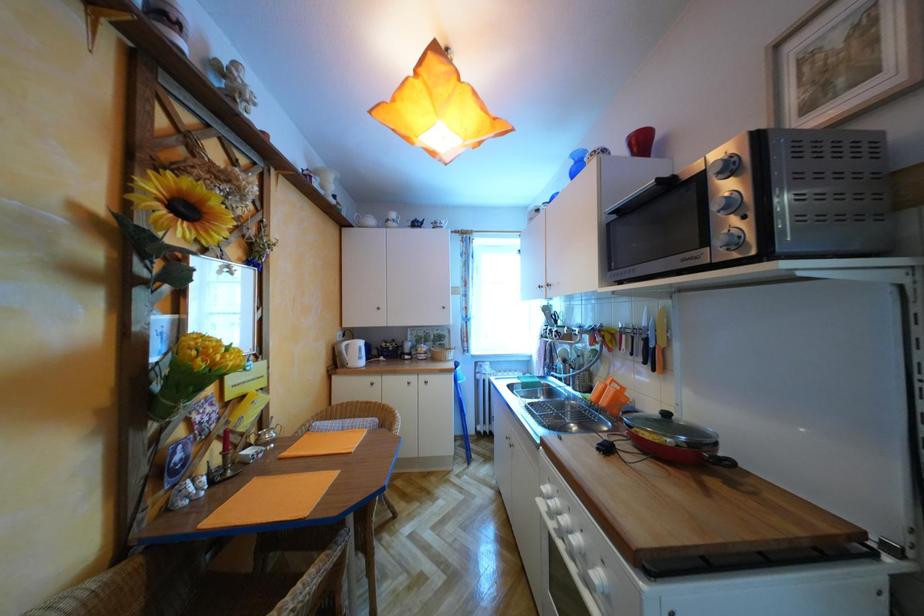
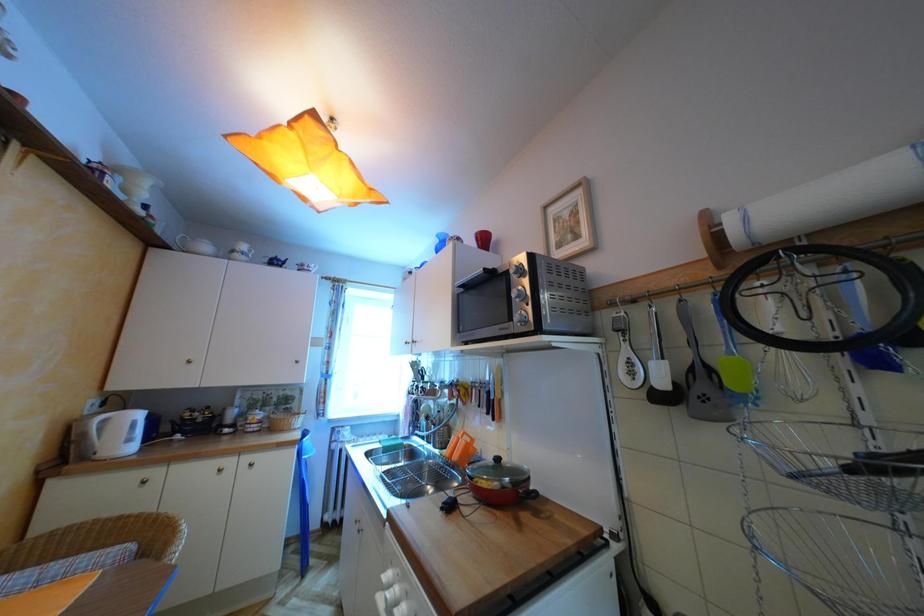
Question: The images are taken continuously from a first-person perspective. In which direction is your viewpoint rotating?

Choices:
 (A) Left
 (B) Right
 (C) Up
 (D) Down

Answer: (B)